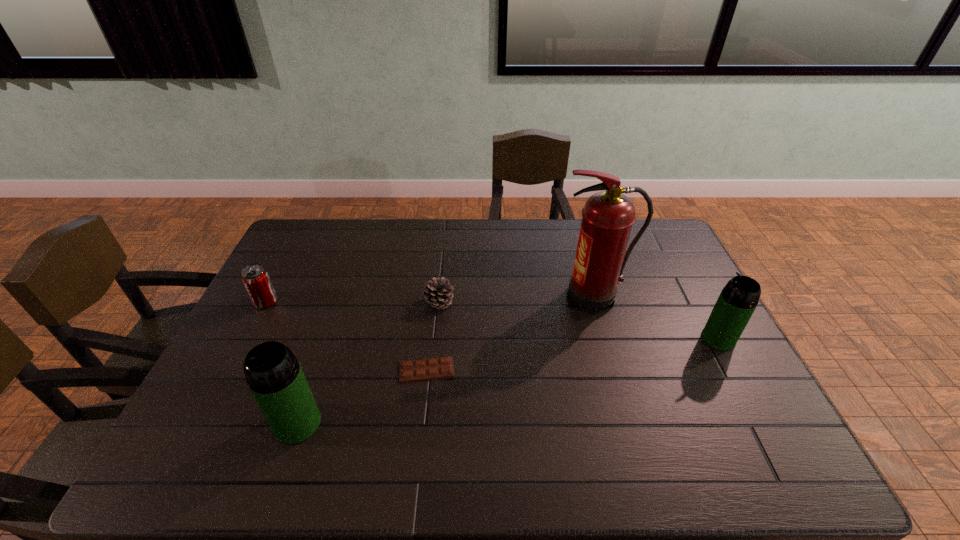
What are the coordinates of `object present at the near edge` in the screenshot? It's located at (275, 378).

I want to click on object at the left edge, so click(255, 278).

This screenshot has height=540, width=960. Find the location of `object at the right edge`. object at the right edge is located at coordinates (736, 303).

I want to click on free spot at the far edge of the desktop, so click(x=513, y=238).

In the image, there is a desktop. Identify the location of vacant space at the near edge. This screenshot has width=960, height=540. (684, 421).

Image resolution: width=960 pixels, height=540 pixels. I want to click on free space at the left edge of the desktop, so click(x=302, y=261).

Identify the location of vacant space at the right edge of the desktop. (676, 293).

The height and width of the screenshot is (540, 960). What are the coordinates of `vacant region at the far left corner of the desktop` in the screenshot? It's located at (305, 228).

Identify the location of vacant space at the far right corner of the desktop. This screenshot has width=960, height=540. (655, 222).

This screenshot has height=540, width=960. What are the coordinates of `empty space that is in between the pinecone and the left thermos bottle` in the screenshot? It's located at (369, 363).